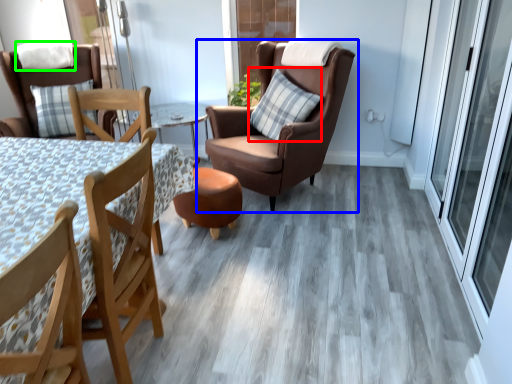
Question: Which is nearer to the pillow (highlighted by a red box)? chair (highlighted by a blue box) or pillow (highlighted by a green box).

Choices:
 (A) chair
 (B) pillow

Answer: (A)